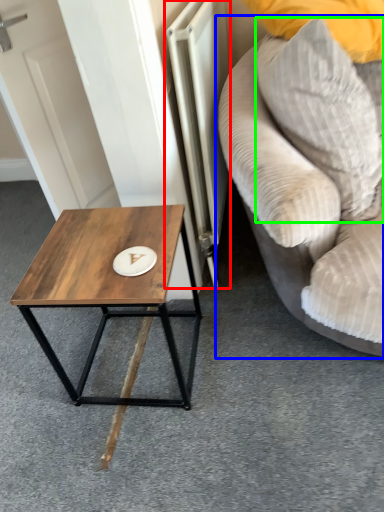
Question: Which is nearer to the radiator (highlighted by a red box)? studio couch (highlighted by a blue box) or pillow (highlighted by a green box).

Choices:
 (A) studio couch
 (B) pillow

Answer: (A)